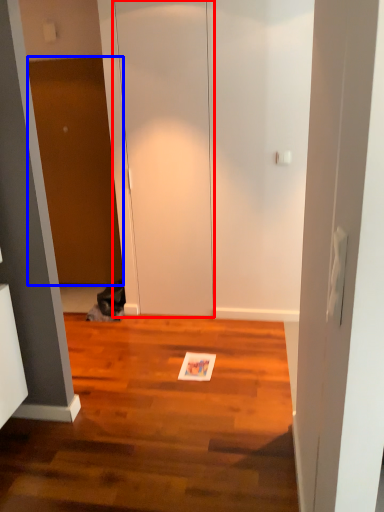
Question: Which of the following is the farthest to the observer, glass door (highlighted by a red box) or door (highlighted by a blue box)?

Choices:
 (A) glass door
 (B) door

Answer: (B)